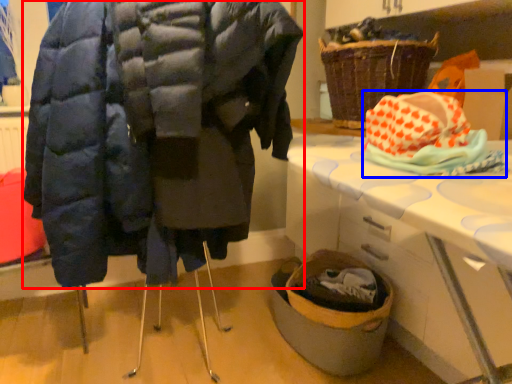
Question: Among these objects, which one is nearest to the camera, coat (highlighted by a red box) or material (highlighted by a blue box)?

Choices:
 (A) coat
 (B) material

Answer: (A)